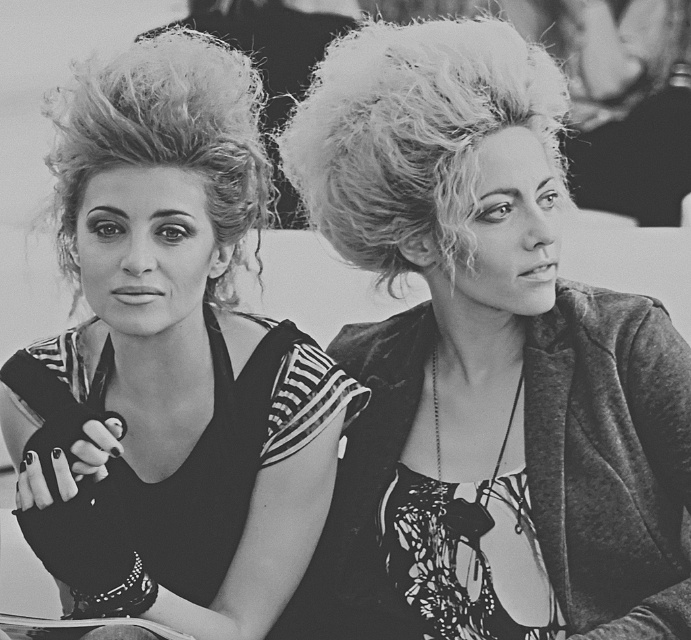
Question: Is the position of fluffy hair at center more distant than that of matte black dress at center?

Choices:
 (A) no
 (B) yes

Answer: (B)

Question: From the image, what is the correct spatial relationship of fluffy hair at center in relation to matte black dress at center?

Choices:
 (A) right
 (B) left

Answer: (A)

Question: Which object appears farthest from the camera in this image?

Choices:
 (A) matte black dress at center
 (B) fluffy hair at center

Answer: (B)

Question: Can you confirm if fluffy hair at center is thinner than matte black dress at center?

Choices:
 (A) yes
 (B) no

Answer: (B)